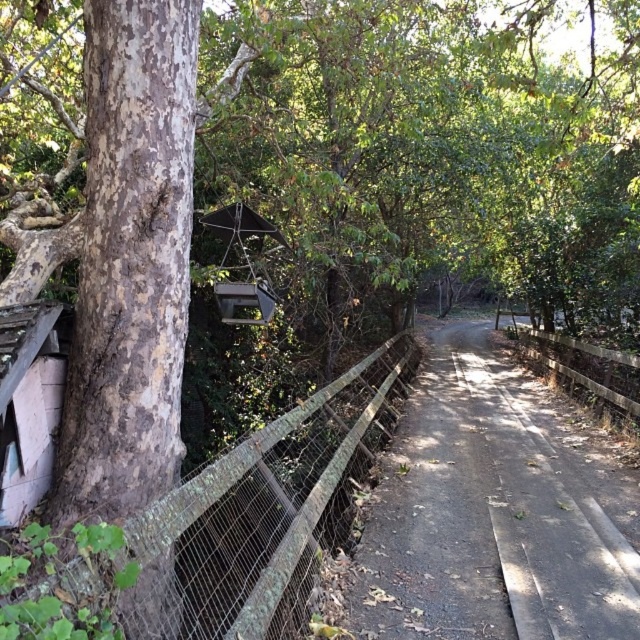
You are a hiker who wants to take a shortcut from the rustic wooden hut at lower left to the wooden at right. Is the path between them clear?

The rustic wooden hut at lower left is positioned over wooden at right, so the path between them is clear.